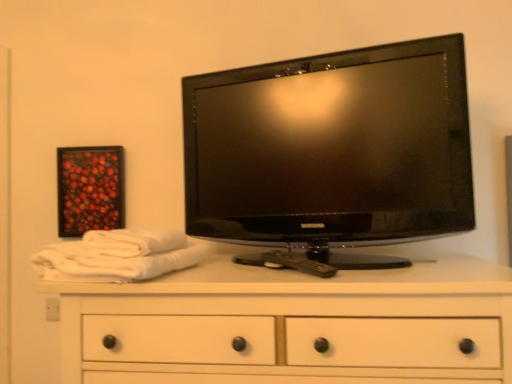
Question: Considering the relative sizes of white cotton bath towel at left, marked as the 2th bath towel in a top-to-bottom arrangement, and wooden framed artwork at upper left in the image provided, is white cotton bath towel at left, marked as the 2th bath towel in a top-to-bottom arrangement, thinner than wooden framed artwork at upper left?

Choices:
 (A) no
 (B) yes

Answer: (A)

Question: Is white cotton bath towel at left, marked as the 2th bath towel in a top-to-bottom arrangement, not close to wooden framed artwork at upper left?

Choices:
 (A) no
 (B) yes

Answer: (A)

Question: From the image's perspective, is white cotton bath towel at left, marked as the 2th bath towel in a top-to-bottom arrangement, below wooden framed artwork at upper left?

Choices:
 (A) no
 (B) yes

Answer: (B)

Question: Can you confirm if white cotton bath towel at left, marked as the 2th bath towel in a top-to-bottom arrangement, is taller than wooden framed artwork at upper left?

Choices:
 (A) no
 (B) yes

Answer: (A)

Question: Can you confirm if white cotton bath towel at left, the 1th bath towel positioned from the bottom, is wider than wooden framed artwork at upper left?

Choices:
 (A) yes
 (B) no

Answer: (A)

Question: Does white cotton bath towel at left, the 1th bath towel positioned from the bottom, lie in front of wooden framed artwork at upper left?

Choices:
 (A) no
 (B) yes

Answer: (B)

Question: Is black glossy tv at upper center aimed at white cotton bath towel at left, the 1th bath towel positioned from the bottom?

Choices:
 (A) no
 (B) yes

Answer: (A)

Question: From a real-world perspective, is black glossy tv at upper center on white cotton bath towel at left, the 1th bath towel positioned from the bottom?

Choices:
 (A) no
 (B) yes

Answer: (B)

Question: Would you say black glossy tv at upper center is a long distance from white cotton bath towel at left, marked as the 2th bath towel in a top-to-bottom arrangement?

Choices:
 (A) no
 (B) yes

Answer: (A)

Question: From a real-world perspective, is black glossy tv at upper center located beneath white cotton bath towel at left, the 1th bath towel positioned from the bottom?

Choices:
 (A) no
 (B) yes

Answer: (A)

Question: From the image's perspective, is black glossy tv at upper center on top of white cotton bath towel at left, the 1th bath towel positioned from the bottom?

Choices:
 (A) yes
 (B) no

Answer: (A)

Question: Is black glossy tv at upper center shorter than white cotton bath towel at left, marked as the 2th bath towel in a top-to-bottom arrangement?

Choices:
 (A) yes
 (B) no

Answer: (B)

Question: From the image's perspective, is white cotton bath towel at left, which is counted as the 2th bath towel, starting from the bottom, under wooden framed artwork at upper left?

Choices:
 (A) no
 (B) yes

Answer: (B)